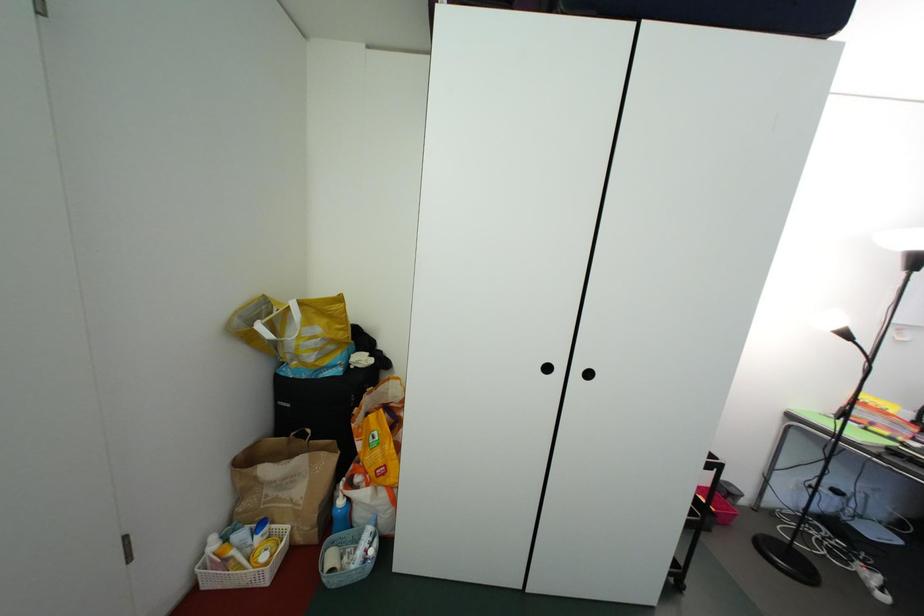
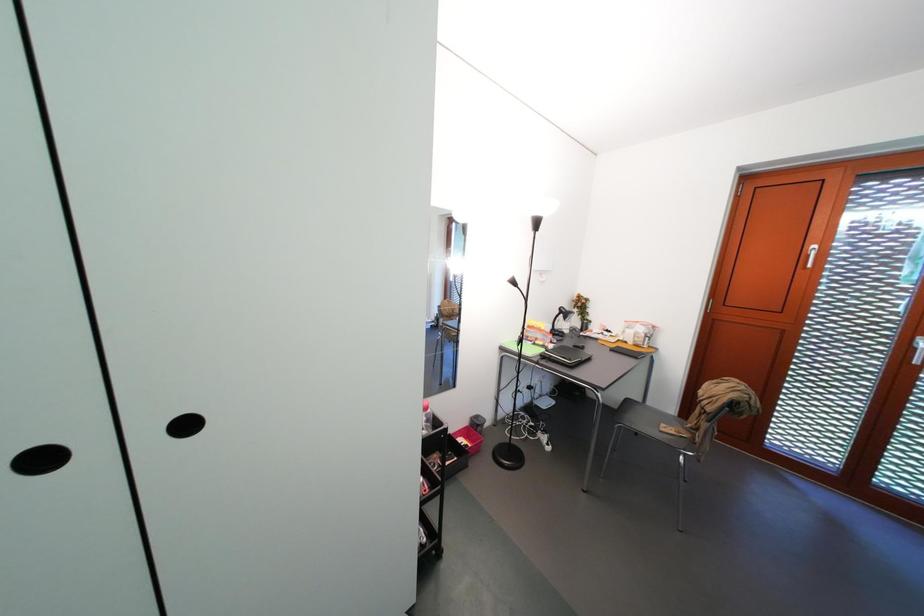
Question: The images are taken continuously from a first-person perspective. In which direction is your viewpoint rotating?

Choices:
 (A) Left
 (B) Right
 (C) Up
 (D) Down

Answer: (B)